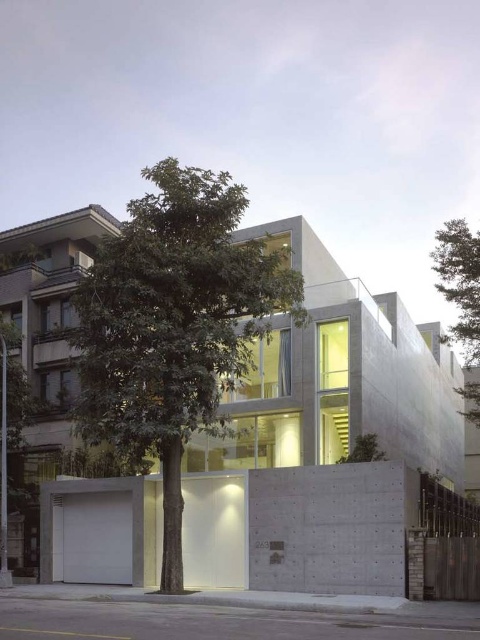
You are standing at the base of the tree in the foreground and looking towards the residential building. There are two points marked on the building facade. Which point, point (x=248, y=292) or point (x=471, y=417), appears closer to you?

Point (x=248, y=292) is in front of point (x=471, y=417), so it appears closer to you.

You are a photographer trying to capture the modern residential building in the background. You notice two green leafy trees in the foreground. Which tree, the green leafy tree at center or the green leafy tree at upper right, is closer to the building?

The green leafy tree at center is positioned on the left side of green leafy tree at upper right, meaning the green leafy tree at upper right is closer to the building.

You are standing in front of the modern residential building and want to take a photo of it without the green leafy tree at center blocking the view. Based on your current position, which direction should you move to ensure the tree is no longer in the frame?

To avoid the green leafy tree at center blocking the view, move to the right side since the tree is positioned at the center, so moving right would shift the frame away from its location at point [173,324].